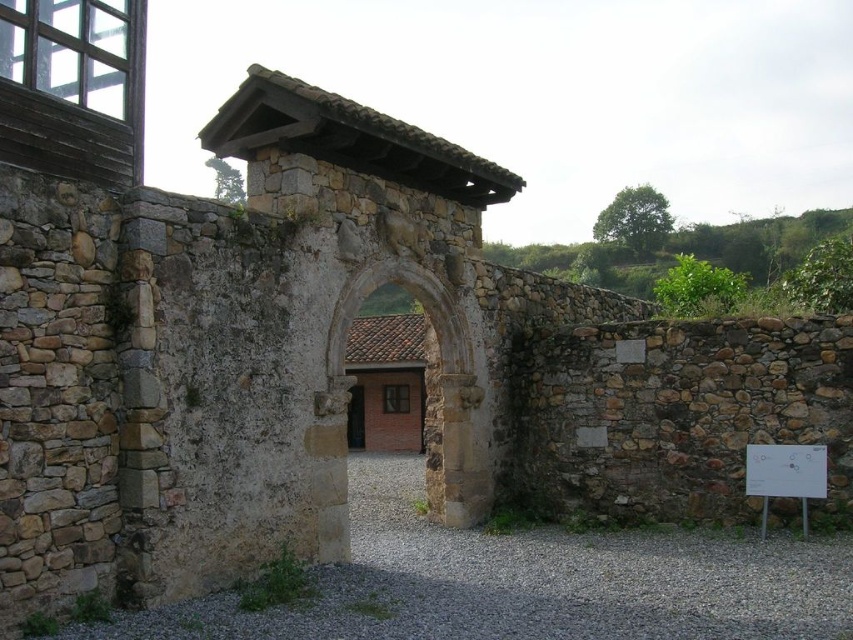
Who is more forward, (340, 502) or (808, 465)?

Point (340, 502) is more forward.

Can you confirm if stone textured archway at center is positioned below white paper at lower right?

Incorrect, stone textured archway at center is not positioned below white paper at lower right.

Between point (456, 504) and point (751, 445), which one is positioned in front?

Point (751, 445)

At what (x,y) coordinates should I click in order to perform the action: click on stone textured archway at center. Please return your answer as a coordinate pair (x, y). The height and width of the screenshot is (640, 853). Looking at the image, I should click on (428, 410).